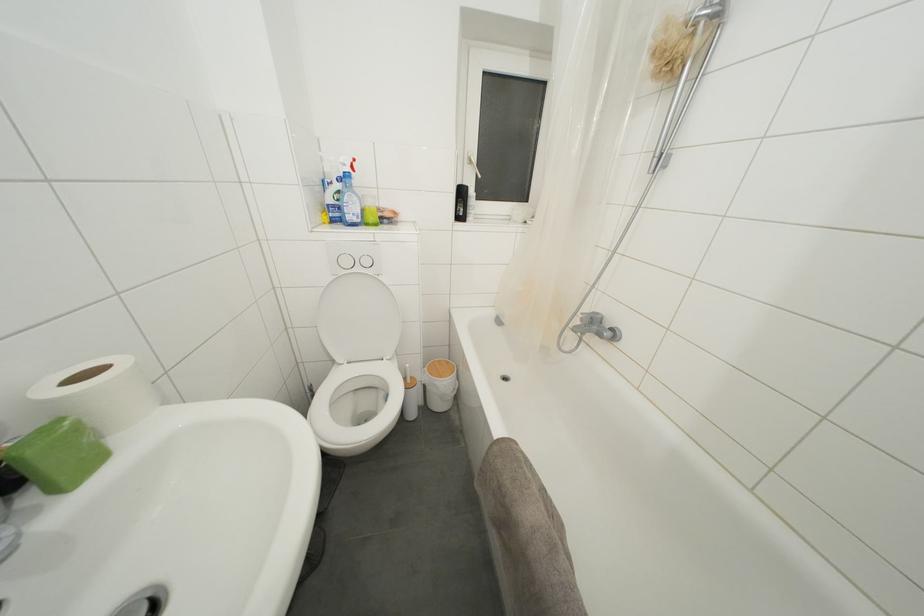
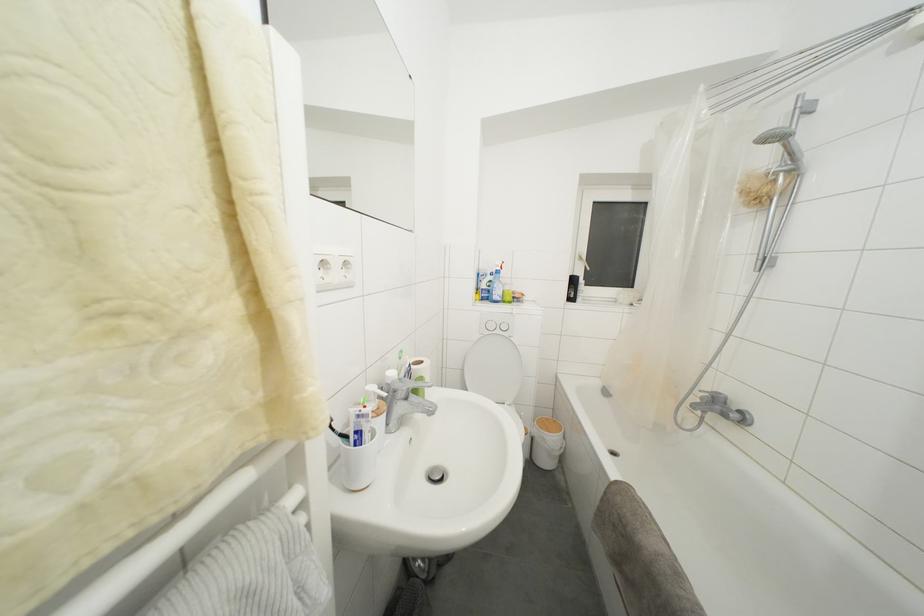
Find the pixel in the second image that matches the point at 341,221 in the first image.

(490, 301)